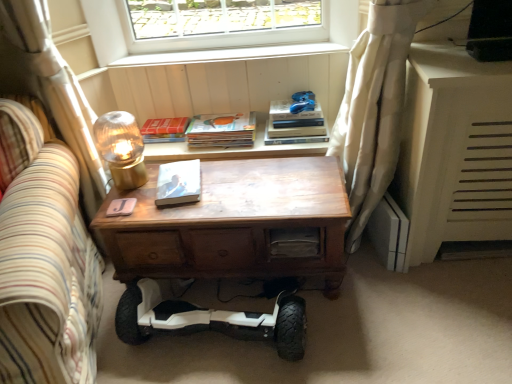
What are the coordinates of `space that is in front of hardcover book at upper center, placed as the 1th paperback book when sorted from top to bottom` in the screenshot? It's located at [x=164, y=147].